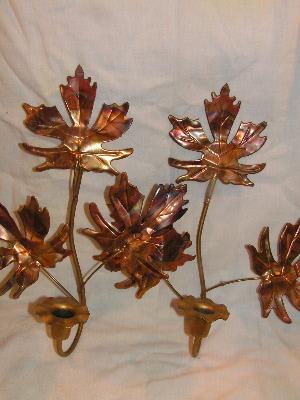
Where is `sheet`? sheet is located at coordinates (146, 123).